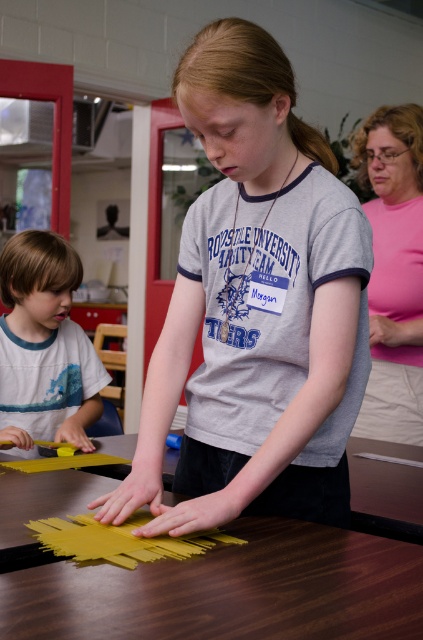
Question: Which object is the closest to the pink fabric at upper right?

Choices:
 (A) wooden table at center
 (B) matte yellow paper at center
 (C) gray matte shirt at center

Answer: (A)

Question: Is the position of gray matte shirt at center more distant than that of wooden table at center?

Choices:
 (A) yes
 (B) no

Answer: (A)

Question: Which is farther from the gray matte shirt at center?

Choices:
 (A) pink fabric at upper right
 (B) matte yellow paper at center

Answer: (B)

Question: Does gray matte shirt at center have a larger size compared to wooden table at center?

Choices:
 (A) yes
 (B) no

Answer: (A)

Question: Which point is closer to the camera?

Choices:
 (A) (214, 97)
 (B) (54, 426)
 (C) (263, 624)
 (D) (417, 365)

Answer: (C)

Question: Is the position of gray matte shirt at center less distant than that of matte yellow paper at center?

Choices:
 (A) yes
 (B) no

Answer: (A)